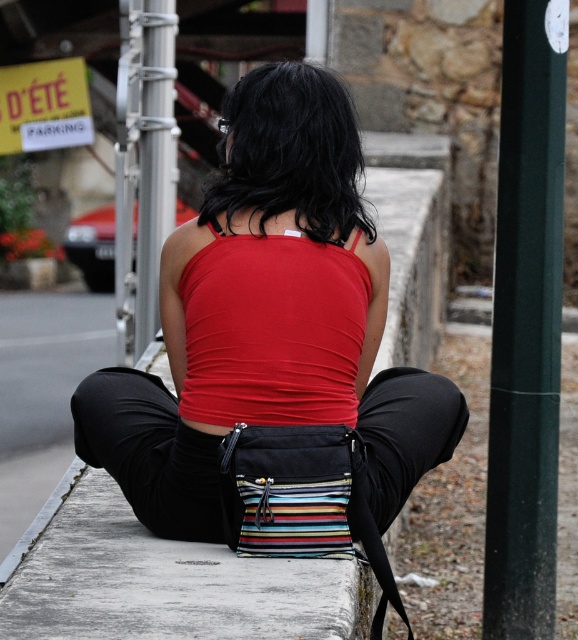
Can you confirm if matte black tank top at center is wider than green matte pole at right?

Indeed, matte black tank top at center has a greater width compared to green matte pole at right.

Is matte black tank top at center positioned at the back of green matte pole at right?

That is False.

The height and width of the screenshot is (640, 578). In order to click on matte black tank top at center in this screenshot , I will do `click(272, 332)`.

Describe the element at coordinates (272, 332) in the screenshot. This screenshot has height=640, width=578. I see `matte black tank top at center` at that location.

At what (x,y) coordinates should I click in order to perform the action: click on matte black tank top at center. Please return your answer as a coordinate pair (x, y). Looking at the image, I should click on (272, 332).

Does green matte pole at right have a greater width compared to red matte tank top at center?

No.

Locate an element on the screen. The image size is (578, 640). green matte pole at right is located at coordinates (527, 324).

Locate an element on the screen. green matte pole at right is located at coordinates (527, 324).